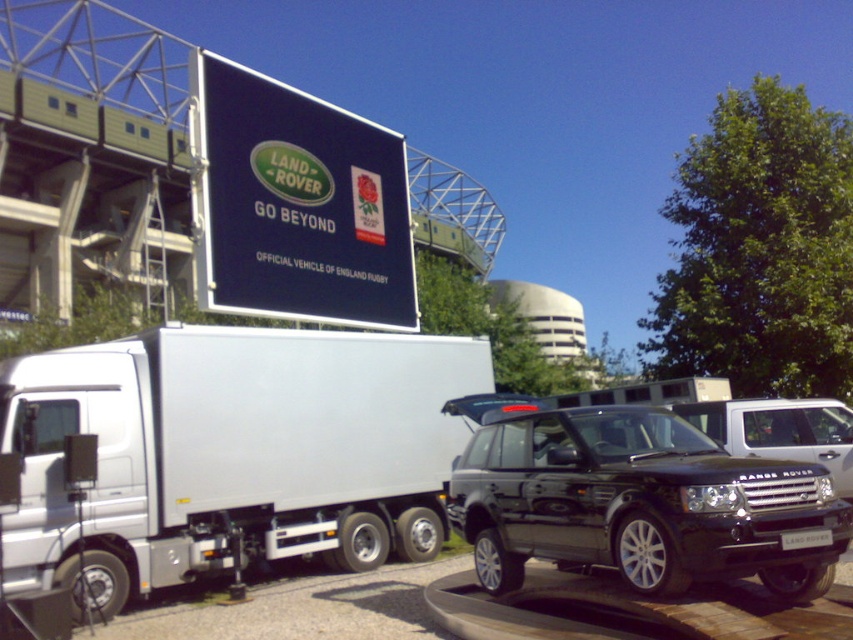
Question: From the image, what is the correct spatial relationship of black metallic suv at center in relation to black metallic car at center?

Choices:
 (A) above
 (B) below

Answer: (B)

Question: Which object appears closest to the camera in this image?

Choices:
 (A) black metallic car at center
 (B) white metallic trailer truck at left

Answer: (B)

Question: Which of these objects is positioned closest to the black metallic car at center?

Choices:
 (A) white metallic trailer truck at left
 (B) black metallic license plate at center

Answer: (B)

Question: Which of these objects is positioned farthest from the black metallic suv at center?

Choices:
 (A) black metallic license plate at center
 (B) white metallic trailer truck at left

Answer: (B)

Question: Does white metallic trailer truck at left appear over black metallic suv at center?

Choices:
 (A) yes
 (B) no

Answer: (B)

Question: Where is white metallic trailer truck at left located in relation to black metallic license plate at center in the image?

Choices:
 (A) below
 (B) above

Answer: (A)